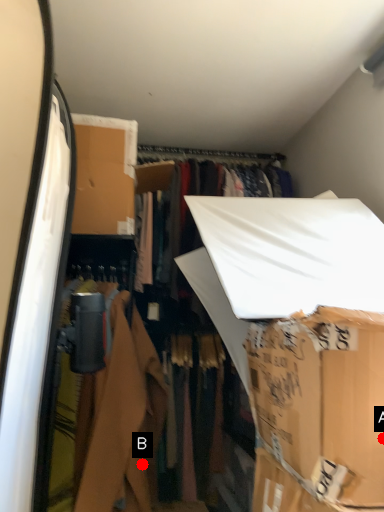
Question: Two points are circled on the image, labeled by A and B beside each circle. Which point is closer to the camera taking this photo?

Choices:
 (A) A is closer
 (B) B is closer

Answer: (A)